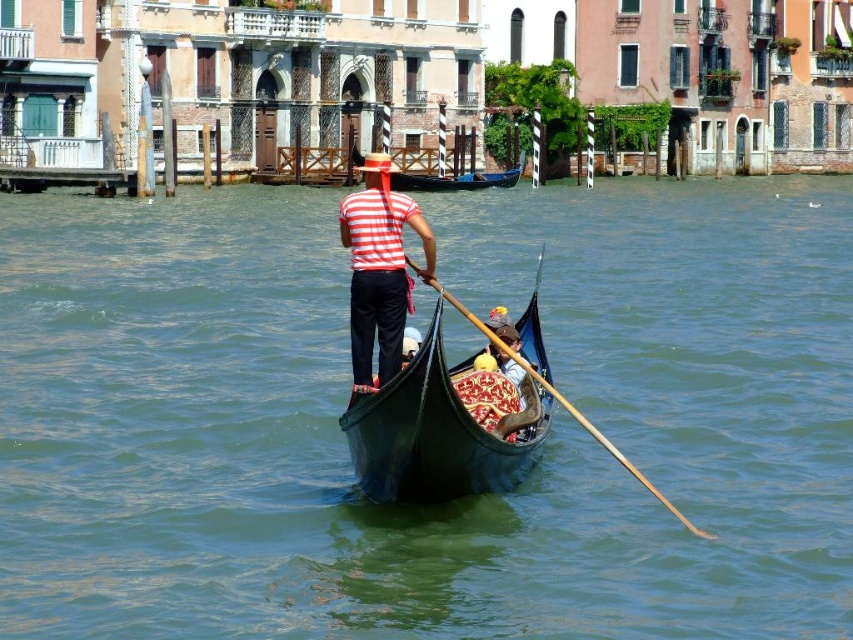
Is black polished wood canoe at center further to camera compared to black glossy canoe at center?

No.

Who is more distant from viewer, (x=405, y=484) or (x=431, y=179)?

Positioned behind is point (x=431, y=179).

The height and width of the screenshot is (640, 853). In order to click on black polished wood canoe at center in this screenshot , I will do `click(432, 435)`.

Is point (397, 467) positioned before point (390, 307)?

Yes.

You are a GUI agent. You are given a task and a screenshot of the screen. Output one action in this format:
    pyautogui.click(x=<x>, y=<y>)
    Task: Click on the black polished wood canoe at center
    This screenshot has height=640, width=853.
    Given the screenshot: What is the action you would take?
    pyautogui.click(x=432, y=435)

Is point (538, 368) positioned after point (363, 342)?

That is True.

At what (x,y) coordinates should I click in order to perform the action: click on black polished wood canoe at center. Please return your answer as a coordinate pair (x, y). This screenshot has height=640, width=853. Looking at the image, I should click on tap(432, 435).

Which is in front, point (491, 465) or point (447, 298)?

Point (491, 465) is in front.

This screenshot has height=640, width=853. Describe the element at coordinates (432, 435) in the screenshot. I see `black polished wood canoe at center` at that location.

Locate an element on the screen. This screenshot has height=640, width=853. black polished wood canoe at center is located at coordinates (432, 435).